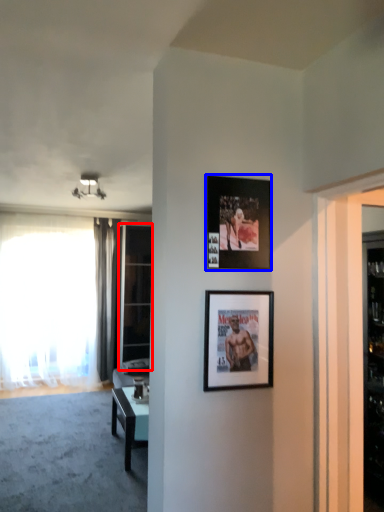
Question: Which point is further to the camera, glass door (highlighted by a red box) or picture frame (highlighted by a blue box)?

Choices:
 (A) glass door
 (B) picture frame

Answer: (A)